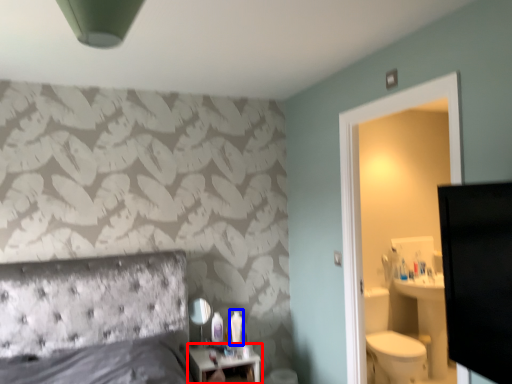
Question: Which object appears farthest to the camera in this image, nightstand (highlighted by a red box) or toiletry (highlighted by a blue box)?

Choices:
 (A) nightstand
 (B) toiletry

Answer: (B)